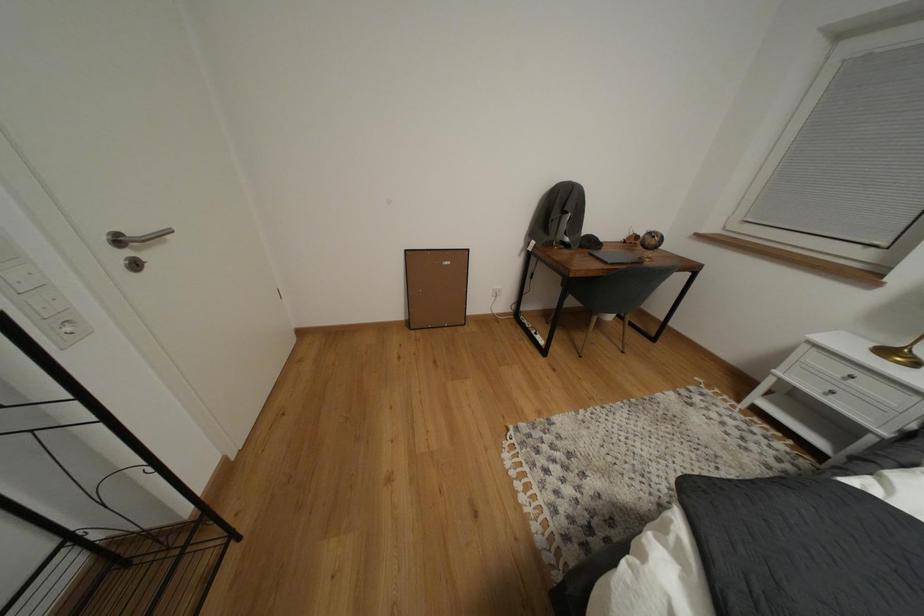
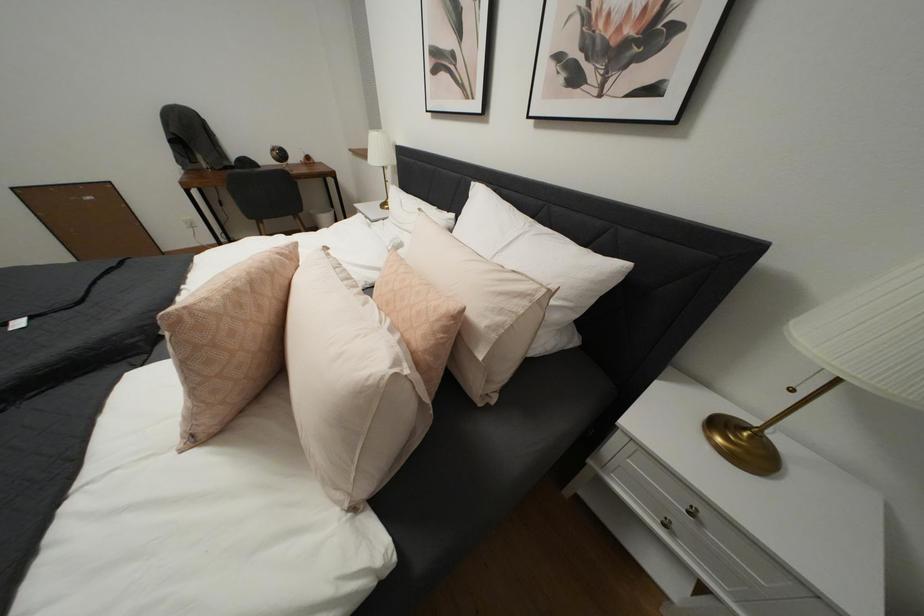
In a continuous first-person perspective shot, in which direction is the camera moving?

The cameraman walked toward right, backward.